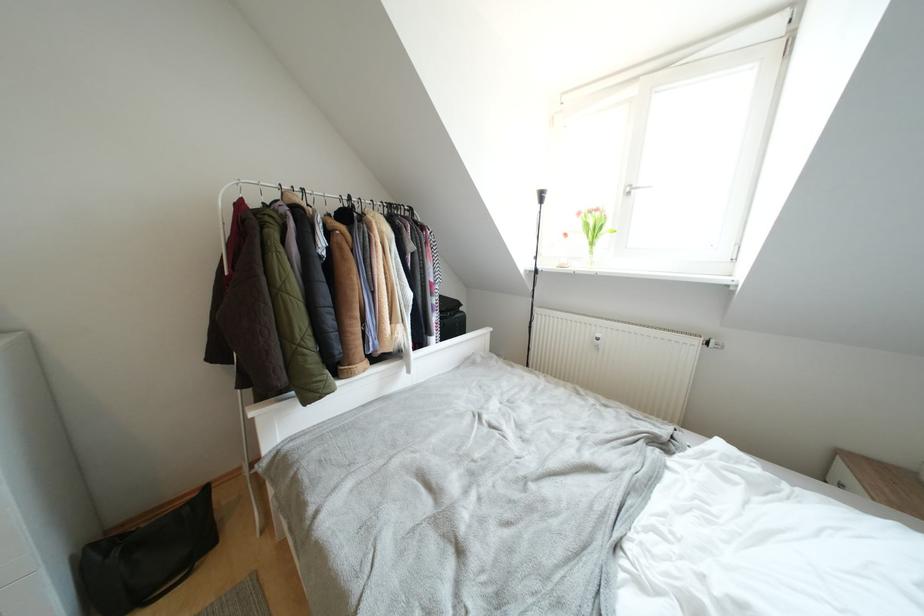
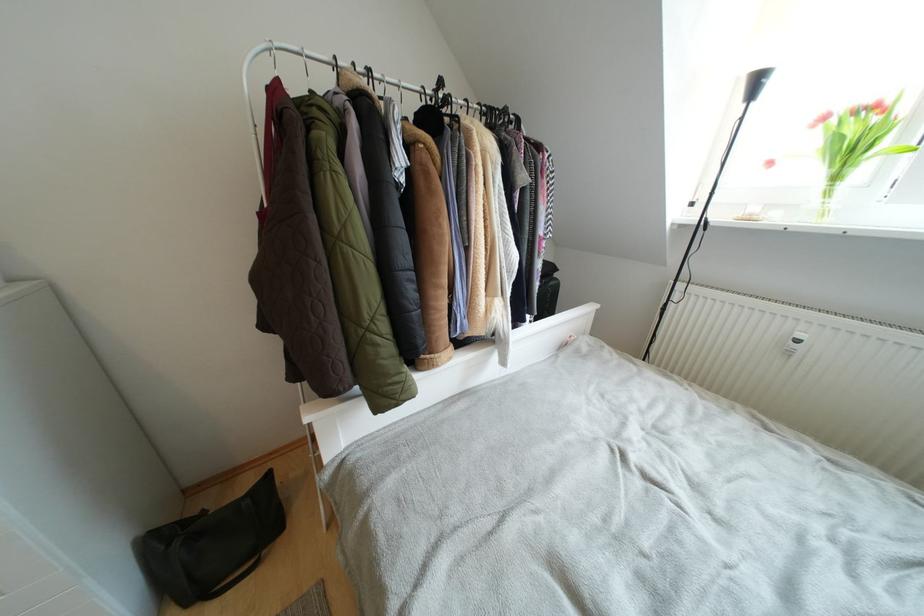
Locate, in the second image, the point that corresponds to the point at 113,559 in the first image.

(175, 549)